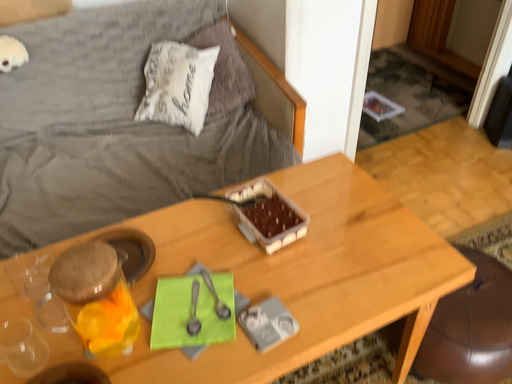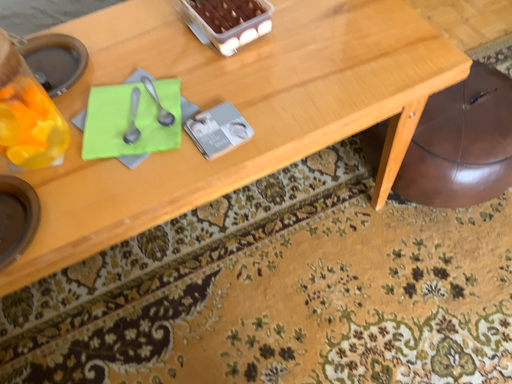
Question: Which way did the camera rotate in the video?

Choices:
 (A) rotated downward
 (B) rotated upward

Answer: (A)